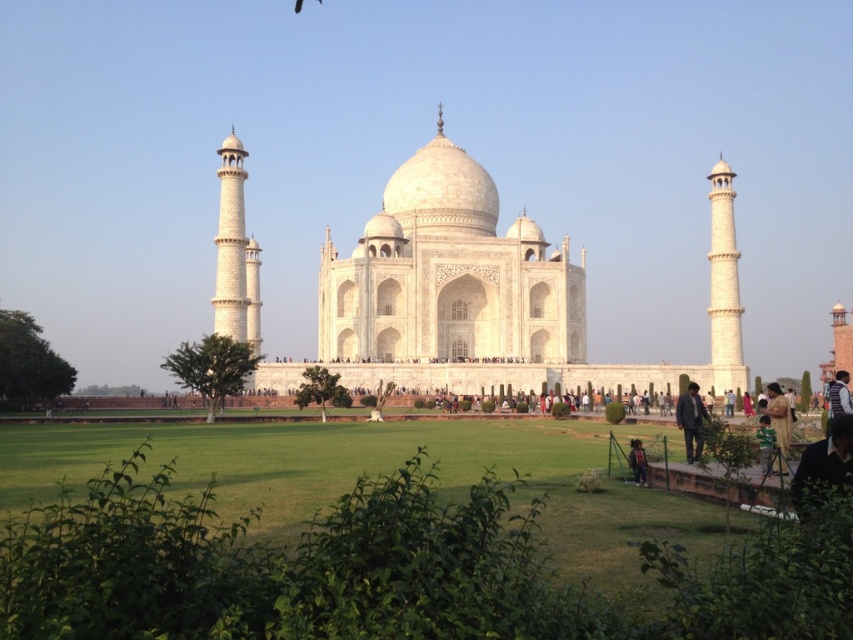
Is dark blue suit at lower right to the left of yellow fabric dress at lower right from the viewer's perspective?

Correct, you'll find dark blue suit at lower right to the left of yellow fabric dress at lower right.

Is dark blue suit at lower right above yellow fabric dress at lower right?

Yes.

Describe the element at coordinates (691, 420) in the screenshot. I see `dark blue suit at lower right` at that location.

The width and height of the screenshot is (853, 640). I want to click on dark blue suit at lower right, so click(x=691, y=420).

Can you confirm if green fabric person at lower right is positioned to the left of dark brown leather jacket at lower right?

In fact, green fabric person at lower right is to the right of dark brown leather jacket at lower right.

Based on the photo, how distant is green fabric person at lower right from dark brown leather jacket at lower right?

green fabric person at lower right is 32.14 feet away from dark brown leather jacket at lower right.

At what (x,y) coordinates should I click in order to perform the action: click on green fabric person at lower right. Please return your answer as a coordinate pair (x, y). The image size is (853, 640). Looking at the image, I should click on (764, 444).

Does yellow fabric dress at lower right come in front of green fabric person at lower right?

Yes.

Is point (786, 474) positioned behind point (764, 476)?

Yes, it is behind point (764, 476).

Does point (775, 424) come in front of point (761, 465)?

No, (775, 424) is further to viewer.

Locate an element on the screen. The image size is (853, 640). yellow fabric dress at lower right is located at coordinates (779, 422).